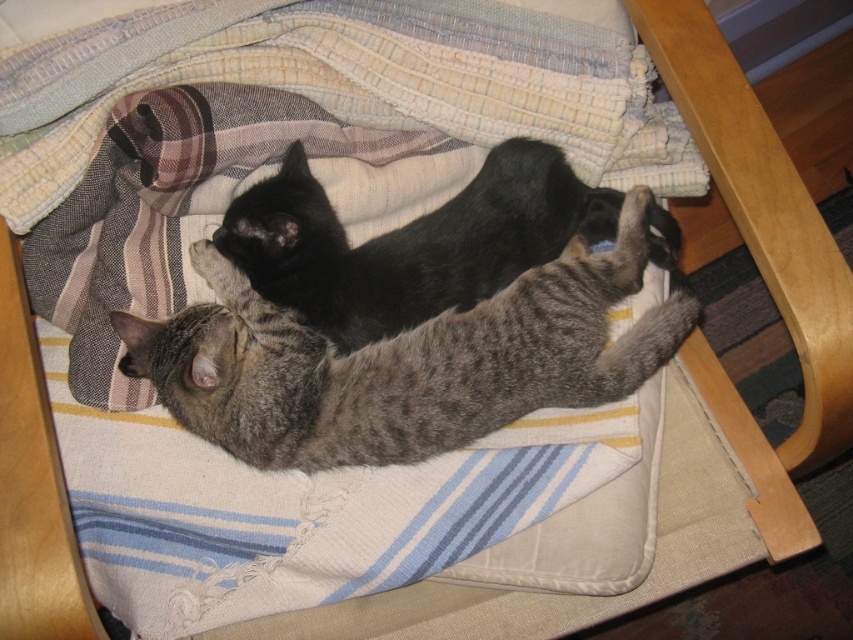
You are looking at the two cats resting on the cushioned surface. Which of the two points, point 1 at coordinates point (369,426) or point 2 at coordinates point (325,273), is closer to you?

Point 1 at coordinates point (369,426) is closer to the viewer than point 2 at coordinates point (325,273).

You are a small toy mouse that is 3 inches long. You want to roll between the gray striped cat at center and the black fur cat at upper center without touching either of them. Is there enough space for you to do this?

The gray striped cat at center and the black fur cat at upper center are 2.99 inches apart. Since the distance between them is less than the length of the toy mouse, there is not enough space to roll between them without touching either cat.